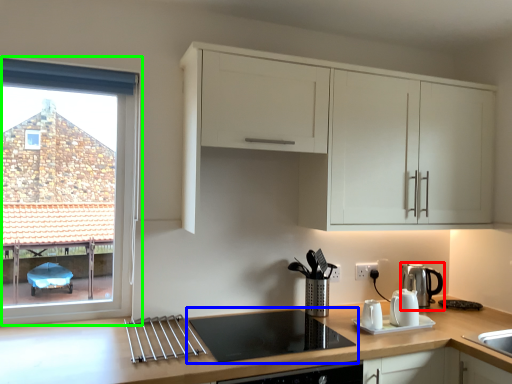
Question: Based on their relative distances, which object is farther from kitchen appliance (highlighted by a red box)? Choose from gas stove (highlighted by a blue box) and window (highlighted by a green box).

Choices:
 (A) gas stove
 (B) window

Answer: (B)